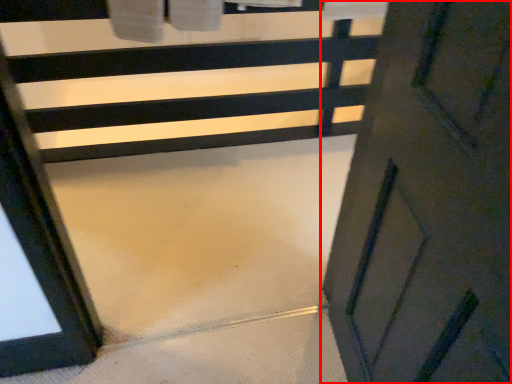
Question: From the image's perspective, considering the relative positions of door (annotated by the red box) and stair in the image provided, where is door (annotated by the red box) located with respect to the staircase?

Choices:
 (A) below
 (B) above

Answer: (A)